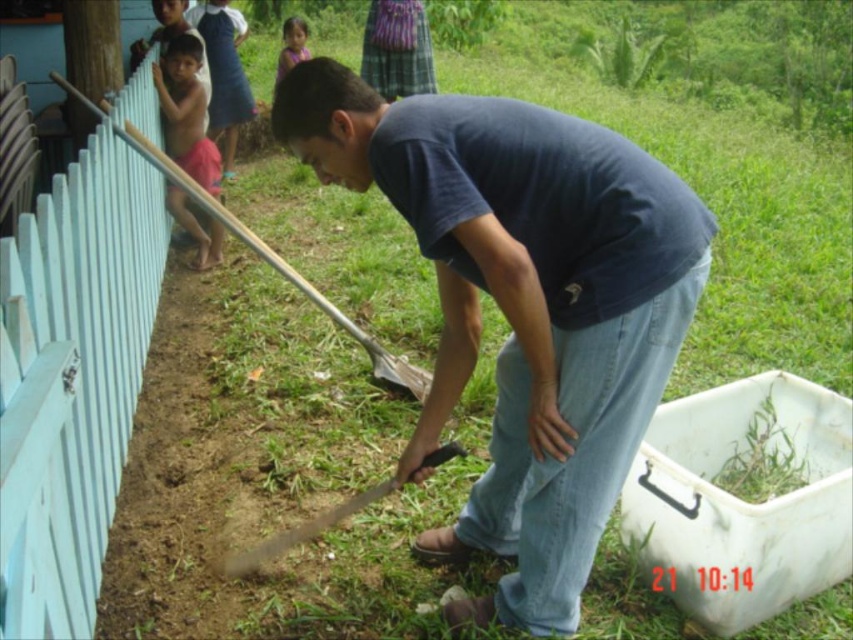
Consider the image. You are standing at the point labeled as point (459, 161) in the image. You want to throw a ball to a friend who is standing 2 meters away from you. Is your friend within reach?

The distance between you and the friend is 2 meters, but the point (459, 161) is only 1.70 meters away from the viewer. Therefore, your friend is beyond the reach of the point (459, 161).

You are a gardener who needs to place a new decorative rock. The rock is 1.2 meters wide. Can the light blue wooden fence at left and the shiny pink shorts at left both fit next to the rock without overlapping?

The light blue wooden fence at left is larger in size than shiny pink shorts at left. Since the fence is larger, it might occupy more space. However, the question specifies placing them next to the rock without overlapping. The rock itself is 1.2 meters wide. Without knowing the exact dimensions of the fence and shorts, we can only infer that both could potentially fit if their combined width plus the rock does not exceed the available space. However, since the fence is larger, it might require more space.